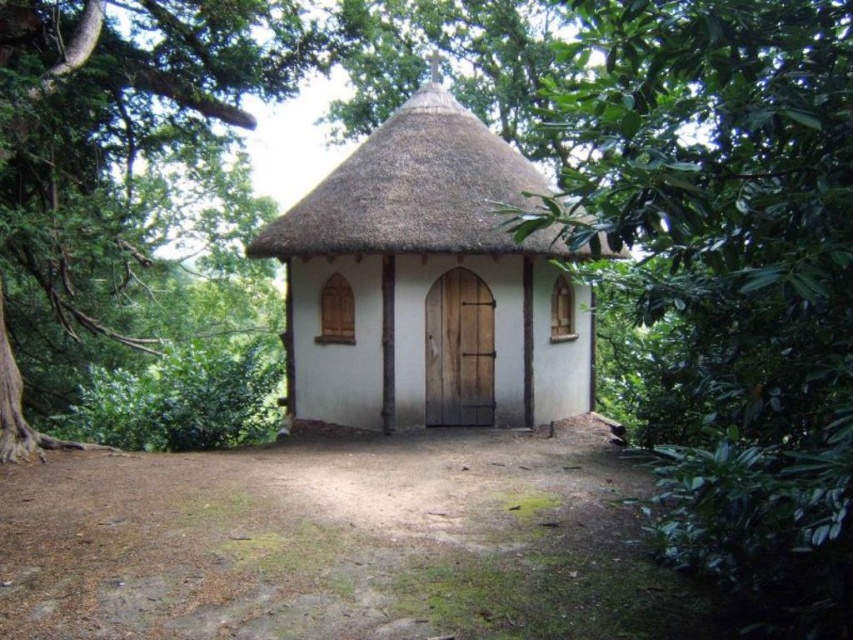
Question: Which of the following is the closest to the observer?

Choices:
 (A) (440, 221)
 (B) (712, 40)

Answer: (B)

Question: Estimate the real-world distances between objects in this image. Which object is closer to the green leafy tree at left?

Choices:
 (A) white wooden cottage at center
 (B) green leafy tree at center

Answer: (A)

Question: Is white wooden cottage at center positioned at the back of green leafy tree at left?

Choices:
 (A) no
 (B) yes

Answer: (B)

Question: Which object is closer to the camera taking this photo?

Choices:
 (A) green leafy tree at center
 (B) white wooden cottage at center

Answer: (A)

Question: Does green leafy tree at center have a greater width compared to white wooden cottage at center?

Choices:
 (A) no
 (B) yes

Answer: (A)

Question: Does green leafy tree at center come behind white wooden cottage at center?

Choices:
 (A) no
 (B) yes

Answer: (A)